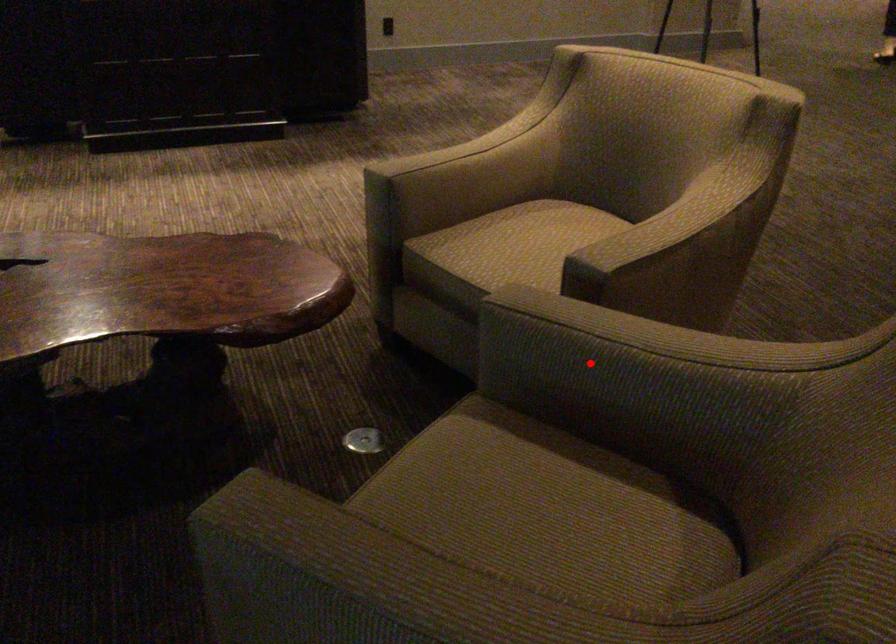
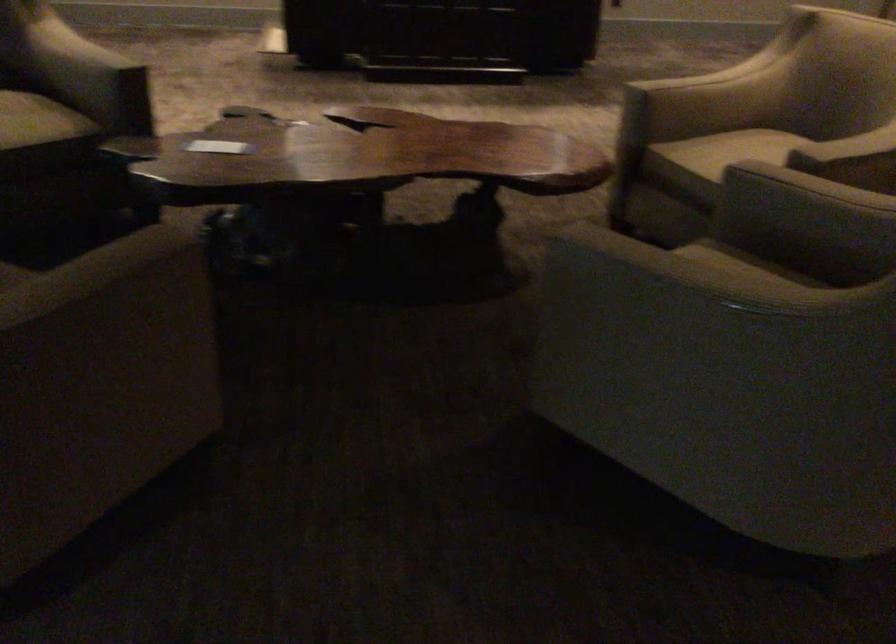
Question: I am providing you with two images of the same scene from different viewpoints. Given a red point in image1, look at the same physical point in image2. Is it:

Choices:
 (A) Closer to the viewpoint
 (B) Farther from the viewpoint

Answer: (B)